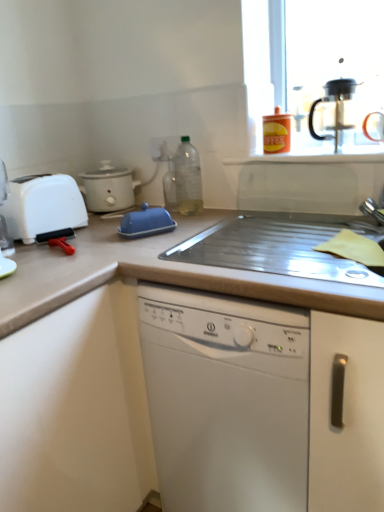
Question: In terms of width, does black plastic coffee machine at upper right look wider or thinner when compared to white matte slow cooker at left, marked as the first kitchen appliance in a back-to-front arrangement?

Choices:
 (A) wide
 (B) thin

Answer: (B)

Question: Is black plastic coffee machine at upper right spatially inside white matte slow cooker at left, which ranks as the 3th kitchen appliance in front-to-back order, or outside of it?

Choices:
 (A) inside
 (B) outside

Answer: (B)

Question: Estimate the real-world distances between objects in this image. Which object is closer to the black plastic coffee machine at upper right?

Choices:
 (A) translucent plastic bottle at center
 (B) transparent plastic bottle at center
 (C) metallic silver sink at center, which is the 2th countertop in bottom-to-top order
 (D) matte plastic container at upper right
 (E) white plastic toaster at left

Answer: (D)

Question: Which object is positioned farthest from the orange matte coffee canister at upper right, which appears as the 2th kitchen appliance when viewed from the back?

Choices:
 (A) beige laminate countertop at center, which is the 1th countertop in bottom-to-top order
 (B) white plastic toaster at left
 (C) blue plastic butter dish at center, acting as the 1th kitchen appliance starting from the front
 (D) white matte slow cooker at left, marked as the first kitchen appliance in a back-to-front arrangement
 (E) matte plastic container at upper right

Answer: (A)